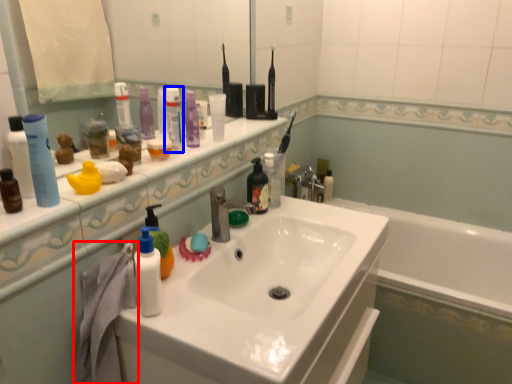
Question: Which point is closer to the camera, bath towel (highlighted by a red box) or mouthwash (highlighted by a blue box)?

Choices:
 (A) bath towel
 (B) mouthwash

Answer: (A)